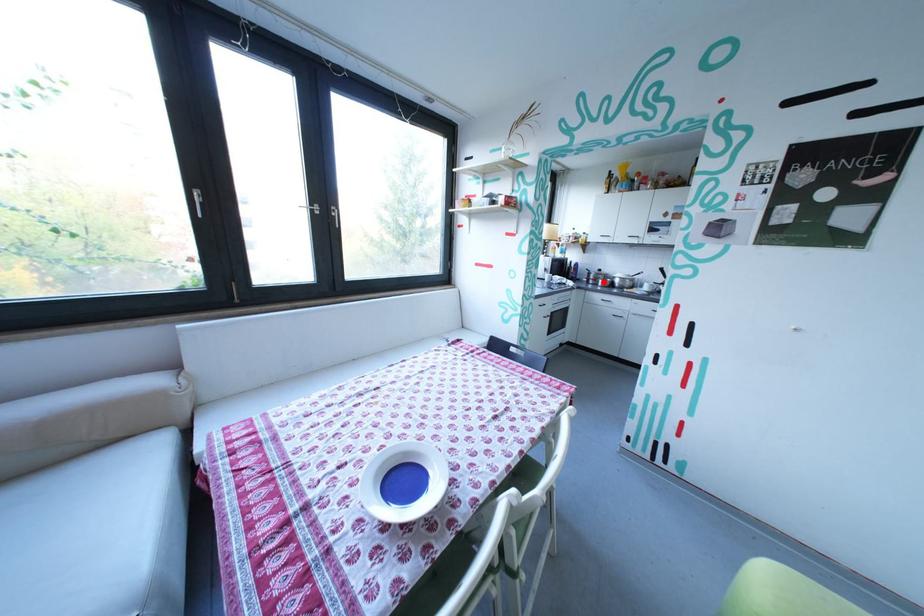
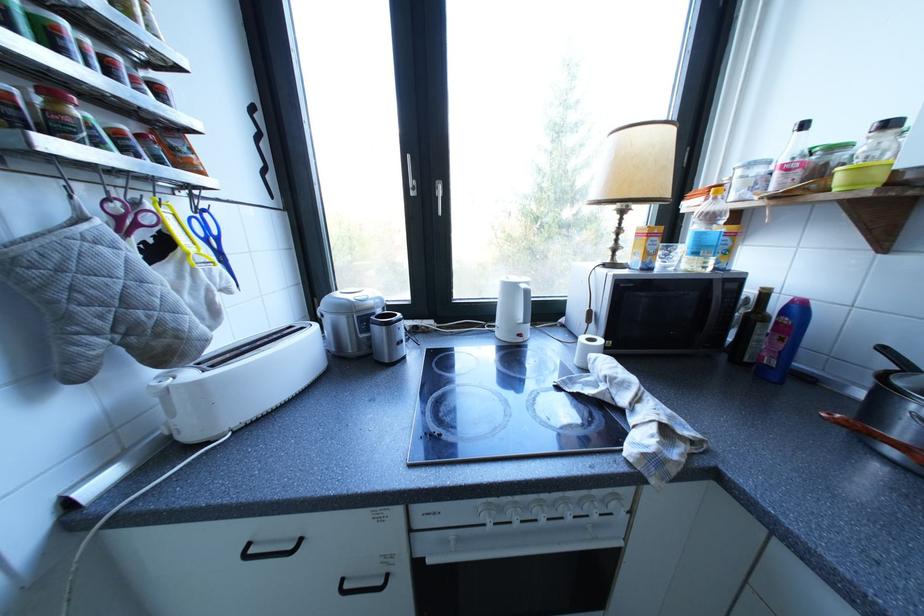
Where in the second image is the point corresponding to the highlighted location from the first image?

(907, 454)